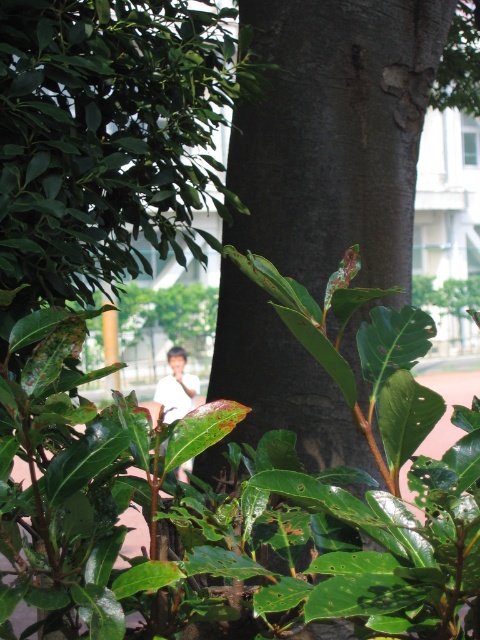
Question: Which point appears closest to the camera in this image?

Choices:
 (A) (192, 378)
 (B) (238, 225)

Answer: (B)

Question: Which point appears closest to the camera in this image?

Choices:
 (A) (286, 166)
 (B) (168, 394)

Answer: (A)

Question: Can you confirm if dark brown rough tree trunk at center is positioned to the left of white matte shirt at center?

Choices:
 (A) no
 (B) yes

Answer: (A)

Question: Considering the relative positions of dark brown rough tree trunk at center and white matte shirt at center in the image provided, where is dark brown rough tree trunk at center located with respect to white matte shirt at center?

Choices:
 (A) right
 (B) left

Answer: (A)

Question: Is dark brown rough tree trunk at center positioned in front of white matte shirt at center?

Choices:
 (A) no
 (B) yes

Answer: (B)